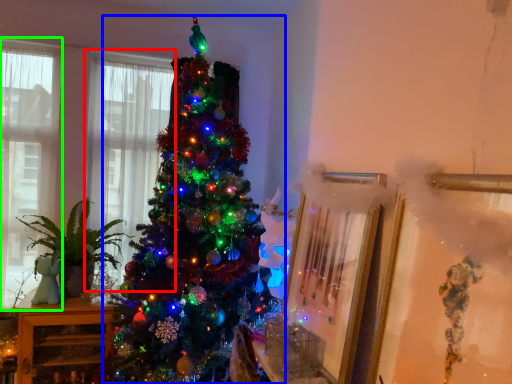
Question: Which object is positioned closest to window (highlighted by a red box)? Select from christmas tree (highlighted by a blue box) and window (highlighted by a green box).

Choices:
 (A) christmas tree
 (B) window

Answer: (B)